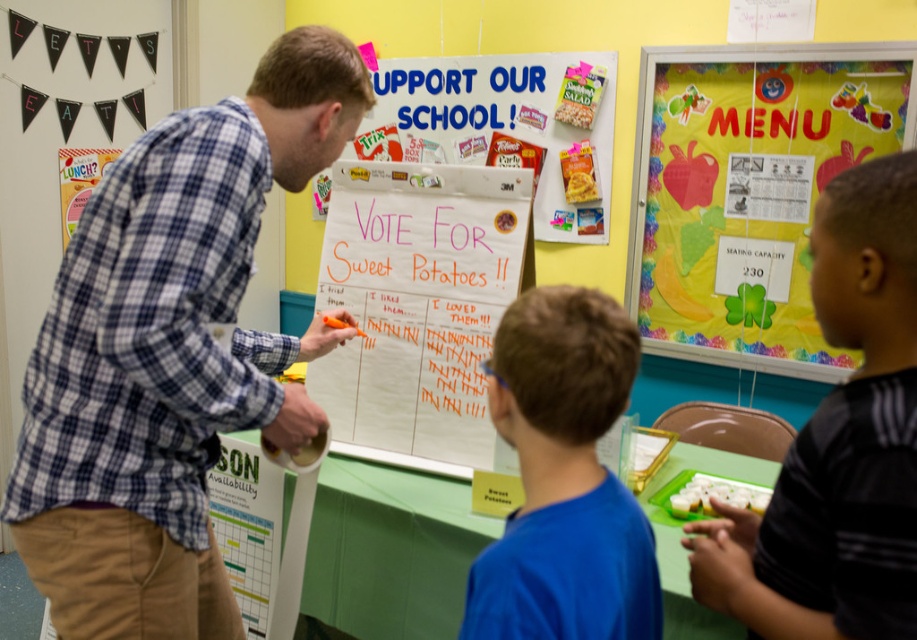
Question: Does blue shirt at center have a lesser width compared to white paperboard at center?

Choices:
 (A) yes
 (B) no

Answer: (A)

Question: Does colorful paper menu at upper right appear under orange marker board at center?

Choices:
 (A) yes
 (B) no

Answer: (B)

Question: Which object is positioned farthest from the white paperboard at center?

Choices:
 (A) orange marker board at center
 (B) blue shirt at center
 (C) green paper poster at lower left
 (D) black striped shirt at right

Answer: (B)

Question: Can you confirm if colorful paper menu at upper right is wider than black striped shirt at right?

Choices:
 (A) no
 (B) yes

Answer: (B)

Question: Which point appears closest to the camera in this image?

Choices:
 (A) (543, 477)
 (B) (449, 378)

Answer: (A)

Question: Which of these objects is positioned farthest from the green paper poster at lower left?

Choices:
 (A) blue shirt at center
 (B) black striped shirt at right
 (C) blue plaid shirt at center
 (D) white paperboard at center

Answer: (D)